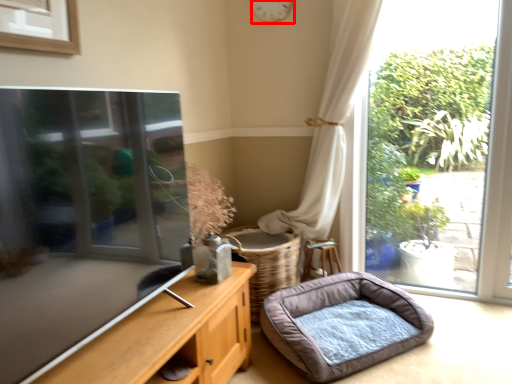
Question: Considering the relative positions of clock (annotated by the red box) and dog bed in the image provided, where is clock (annotated by the red box) located with respect to the staircase?

Choices:
 (A) left
 (B) right

Answer: (A)